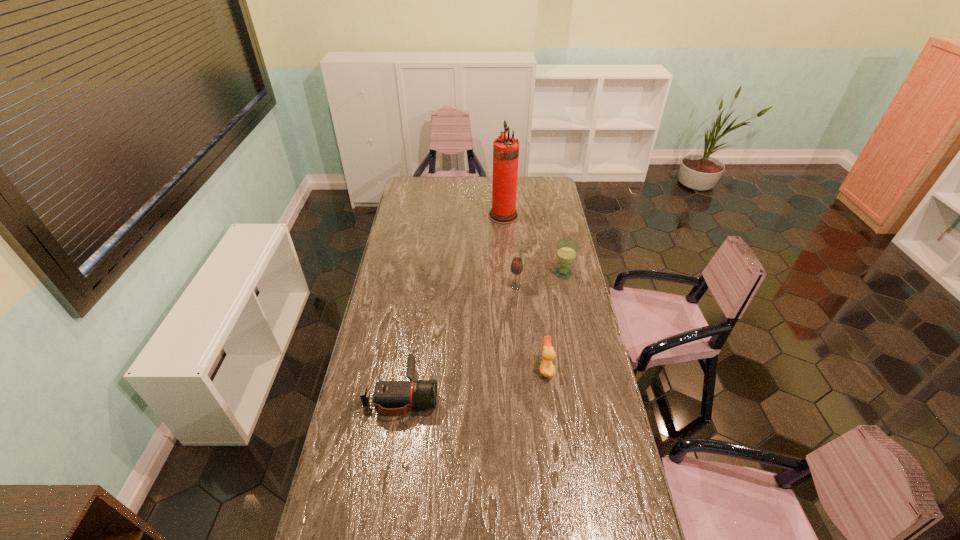
The width and height of the screenshot is (960, 540). What are the coordinates of `free space located at the discharge end of the fire extinguisher` in the screenshot? It's located at (474, 215).

This screenshot has width=960, height=540. In order to click on vacant area situated 0.210m on the back of the fourth nearest object in this screenshot , I will do `click(557, 240)`.

Locate an element on the screen. vacant space located on the right of the left glass drink container is located at coordinates (582, 286).

This screenshot has width=960, height=540. What are the coordinates of `vacant space located on the beak of the second object from right to left` in the screenshot? It's located at (474, 369).

I want to click on vacant space situated on the beak of the second object from right to left, so click(x=494, y=369).

Find the location of a particular element. This screenshot has height=540, width=960. vacant space located 0.150m on the beak of the second object from right to left is located at coordinates (500, 369).

In order to click on free spot located on the lens of the camcorder in this screenshot , I will do `click(508, 393)`.

At what (x,y) coordinates should I click in order to perform the action: click on object at the left edge. Please return your answer as a coordinate pair (x, y). The width and height of the screenshot is (960, 540). Looking at the image, I should click on (392, 398).

Find the location of a particular element. object located at the right edge is located at coordinates (567, 249).

This screenshot has width=960, height=540. What are the coordinates of `vacant space at the far edge of the desktop` in the screenshot? It's located at (457, 192).